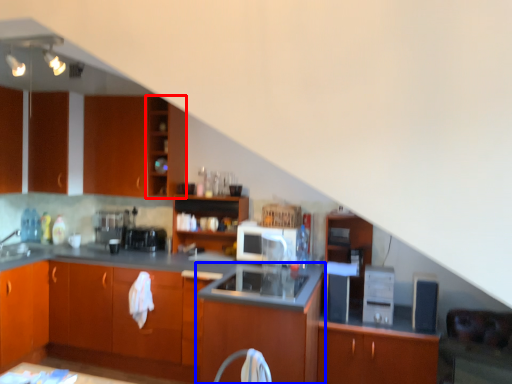
Question: Which of the following is the farthest to the observer, shelf (highlighted by a red box) or cabinetry (highlighted by a blue box)?

Choices:
 (A) shelf
 (B) cabinetry

Answer: (A)